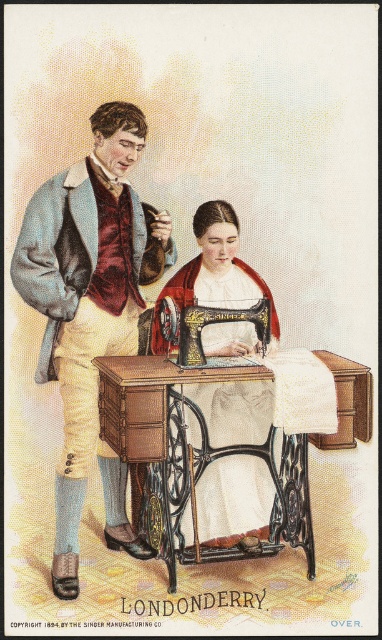
Does black wrought iron sewing machine at center have a greater width compared to black cast iron sewing machine at center?

Indeed, black wrought iron sewing machine at center has a greater width compared to black cast iron sewing machine at center.

Can you confirm if black wrought iron sewing machine at center is smaller than black cast iron sewing machine at center?

No.

Is point (239, 378) behind point (189, 352)?

No, it is not.

The width and height of the screenshot is (382, 640). Find the location of `black wrought iron sewing machine at center`. black wrought iron sewing machine at center is located at coordinates (192, 458).

Between black wrought iron sewing machine at center and matte black sewing machine at center, which one is positioned higher?

matte black sewing machine at center

Can you confirm if black wrought iron sewing machine at center is wider than matte black sewing machine at center?

Yes.

Locate an element on the screen. This screenshot has height=640, width=382. black wrought iron sewing machine at center is located at coordinates (192, 458).

Between matte black sewing machine at center and black cast iron sewing machine at center, which one appears on the left side from the viewer's perspective?

Positioned to the left is black cast iron sewing machine at center.

Does matte black sewing machine at center appear on the right side of black cast iron sewing machine at center?

Correct, you'll find matte black sewing machine at center to the right of black cast iron sewing machine at center.

The image size is (382, 640). Find the location of `matte black sewing machine at center`. matte black sewing machine at center is located at coordinates (215, 273).

Locate an element on the screen. matte black sewing machine at center is located at coordinates (215, 273).